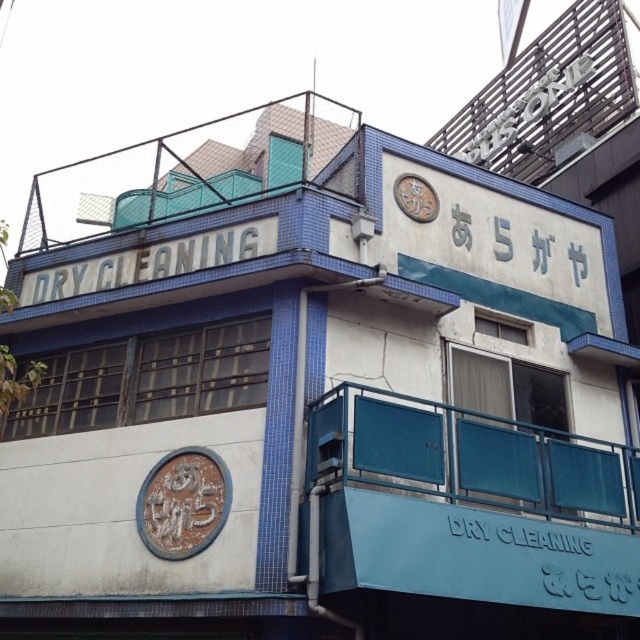
From the picture: You are standing in front of the building and notice two items on the upper level. The first is a white metallic sign at center and the second is a brown textured clock at upper center. Which one is positioned to the right?

The white metallic sign at center is to the right of the brown textured clock at upper center.

You are a customer standing in front of the dry cleaning building. You notice two signs above you. Which one is wider between the white painted metal sign at upper center and the white metallic sign at center?

The white painted metal sign at upper center is wider than the white metallic sign at center.

You are a customer looking for the entrance to the dry cleaning store. You see the teal glass balcony at lower right and the brown textured clock at upper center. Which object is located more to the right side of the building?

The teal glass balcony at lower right is positioned on the right side of the brown textured clock at upper center, so it is located more to the right side of the building.